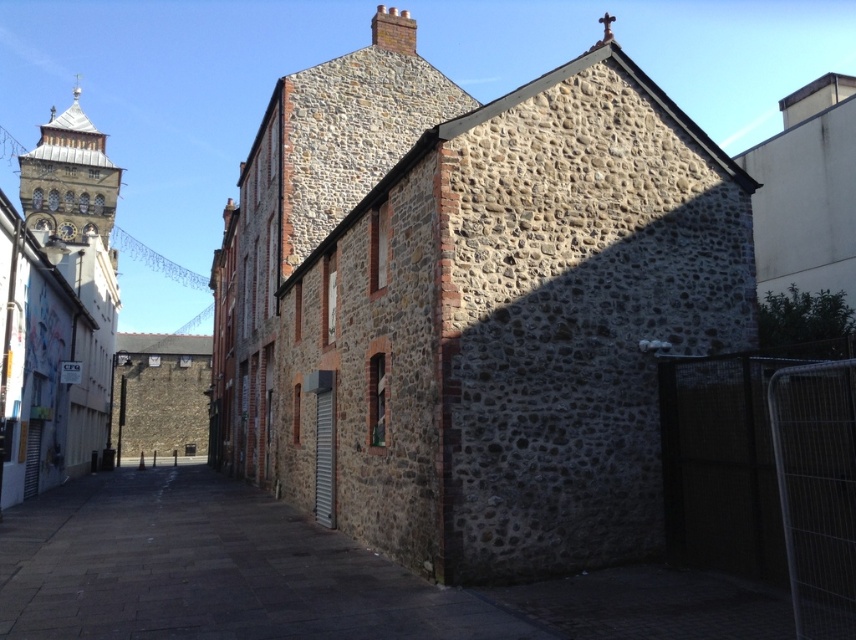
Question: Which point is farther to the camera?

Choices:
 (A) (69, 172)
 (B) (117, 614)
 (C) (79, 378)

Answer: (A)

Question: Is stone textured church at center further to the viewer compared to dark stone alley at center?

Choices:
 (A) yes
 (B) no

Answer: (A)

Question: Which of the following is the closest to the observer?

Choices:
 (A) dark stone alley at center
 (B) stone textured church at center
 (C) stone clock tower at upper left
 (D) stone clock tower at left

Answer: (A)

Question: Is the position of stone textured church at center less distant than that of stone clock tower at left?

Choices:
 (A) no
 (B) yes

Answer: (B)

Question: Which of these objects is positioned closest to the stone clock tower at left?

Choices:
 (A) stone clock tower at upper left
 (B) stone textured church at center
 (C) dark stone alley at center

Answer: (A)

Question: Is dark stone alley at center to the left of stone clock tower at upper left from the viewer's perspective?

Choices:
 (A) yes
 (B) no

Answer: (B)